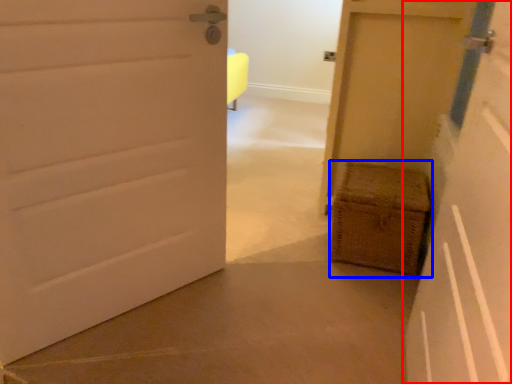
Question: Which object is further to the camera taking this photo, door (highlighted by a red box) or basket (highlighted by a blue box)?

Choices:
 (A) door
 (B) basket

Answer: (B)